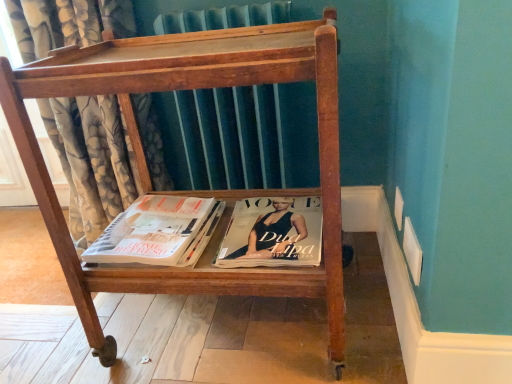
Question: Is floral fabric curtain at left shorter than wooden magazine rack at center?

Choices:
 (A) yes
 (B) no

Answer: (B)

Question: Is floral fabric curtain at left to the right of wooden magazine rack at center from the viewer's perspective?

Choices:
 (A) yes
 (B) no

Answer: (B)

Question: Is floral fabric curtain at left positioned behind wooden magazine rack at center?

Choices:
 (A) yes
 (B) no

Answer: (A)

Question: Could you tell me if floral fabric curtain at left is turned towards wooden magazine rack at center?

Choices:
 (A) yes
 (B) no

Answer: (B)

Question: From the image's perspective, is floral fabric curtain at left located beneath wooden magazine rack at center?

Choices:
 (A) yes
 (B) no

Answer: (B)

Question: Is point (104, 175) closer or farther from the camera than point (140, 79)?

Choices:
 (A) closer
 (B) farther

Answer: (B)

Question: Considering the positions of floral fabric curtain at left and wooden magazine rack at center in the image, is floral fabric curtain at left bigger or smaller than wooden magazine rack at center?

Choices:
 (A) small
 (B) big

Answer: (B)

Question: From a real-world perspective, relative to wooden magazine rack at center, is floral fabric curtain at left vertically above or below?

Choices:
 (A) below
 (B) above

Answer: (B)

Question: In the image, is floral fabric curtain at left positioned in front of or behind wooden magazine rack at center?

Choices:
 (A) behind
 (B) front

Answer: (A)

Question: From a real-world perspective, is wooden magazine rack at center positioned above or below matte white book at center?

Choices:
 (A) below
 (B) above

Answer: (B)

Question: Considering the positions of point (338, 261) and point (178, 211), is point (338, 261) closer or farther from the camera than point (178, 211)?

Choices:
 (A) farther
 (B) closer

Answer: (B)

Question: Based on their sizes in the image, would you say wooden magazine rack at center is bigger or smaller than matte white book at center?

Choices:
 (A) big
 (B) small

Answer: (A)

Question: Relative to matte white book at center, is wooden magazine rack at center in front or behind?

Choices:
 (A) behind
 (B) front

Answer: (B)

Question: Is wooden magazine rack at center to the left or to the right of floral fabric curtain at left in the image?

Choices:
 (A) right
 (B) left

Answer: (A)

Question: Does point (184, 279) appear closer or farther from the camera than point (64, 6)?

Choices:
 (A) farther
 (B) closer

Answer: (B)